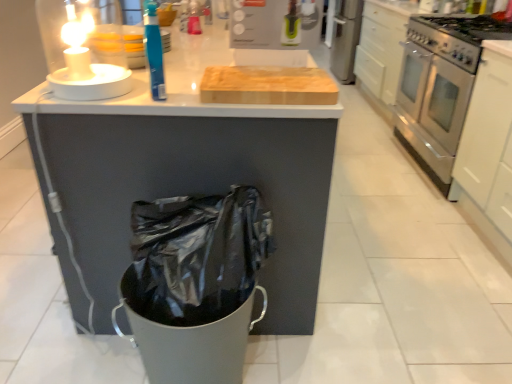
Question: Is white glossy drawer at upper right positioned before stainless steel gas stove at right?

Choices:
 (A) no
 (B) yes

Answer: (A)

Question: Is white glossy drawer at upper right completely or partially outside of stainless steel gas stove at right?

Choices:
 (A) yes
 (B) no

Answer: (A)

Question: Is white glossy drawer at upper right shorter than stainless steel gas stove at right?

Choices:
 (A) yes
 (B) no

Answer: (B)

Question: From the image's perspective, is white glossy drawer at upper right located above stainless steel gas stove at right?

Choices:
 (A) no
 (B) yes

Answer: (B)

Question: Can you confirm if white glossy drawer at upper right is positioned to the right of stainless steel gas stove at right?

Choices:
 (A) yes
 (B) no

Answer: (B)

Question: Can you confirm if white glossy drawer at upper right is taller than stainless steel gas stove at right?

Choices:
 (A) yes
 (B) no

Answer: (A)

Question: Does white glossy drawer at upper right turn towards white matte cabinet at right?

Choices:
 (A) no
 (B) yes

Answer: (A)

Question: Does white glossy drawer at upper right have a larger size compared to white matte cabinet at right?

Choices:
 (A) no
 (B) yes

Answer: (B)

Question: Is white glossy drawer at upper right taller than white matte cabinet at right?

Choices:
 (A) no
 (B) yes

Answer: (A)

Question: From the image's perspective, is white glossy drawer at upper right on top of white matte cabinet at right?

Choices:
 (A) no
 (B) yes

Answer: (B)

Question: Is white matte cabinet at right surrounded by white glossy drawer at upper right?

Choices:
 (A) no
 (B) yes

Answer: (A)

Question: Is white glossy drawer at upper right oriented away from white matte cabinet at right?

Choices:
 (A) yes
 (B) no

Answer: (B)

Question: Is stainless steel gas stove at right positioned with its back to blue plastic bottle at upper center?

Choices:
 (A) no
 (B) yes

Answer: (A)